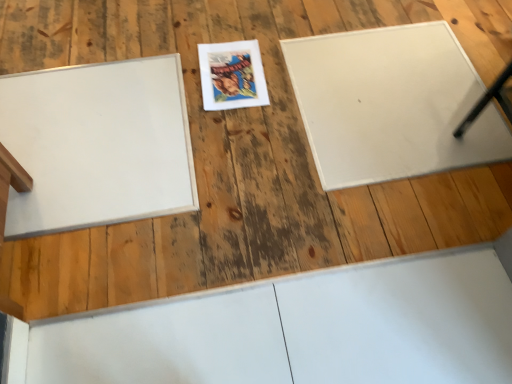
What are the coordinates of `vacant space behind matte paper comic book at center` in the screenshot? It's located at (245, 36).